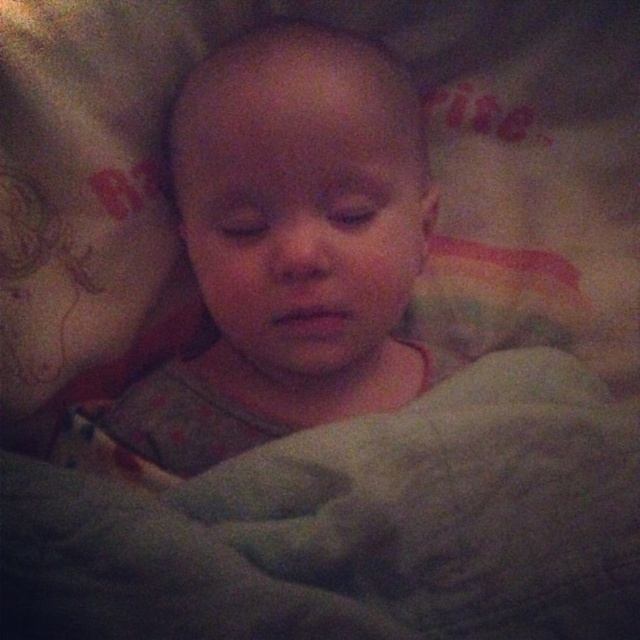
Between soft gray fabric at lower center and smooth gray baby at center, which one has more height?

With more height is smooth gray baby at center.

Where is `soft gray fabric at lower center`? This screenshot has height=640, width=640. soft gray fabric at lower center is located at coordinates (355, 525).